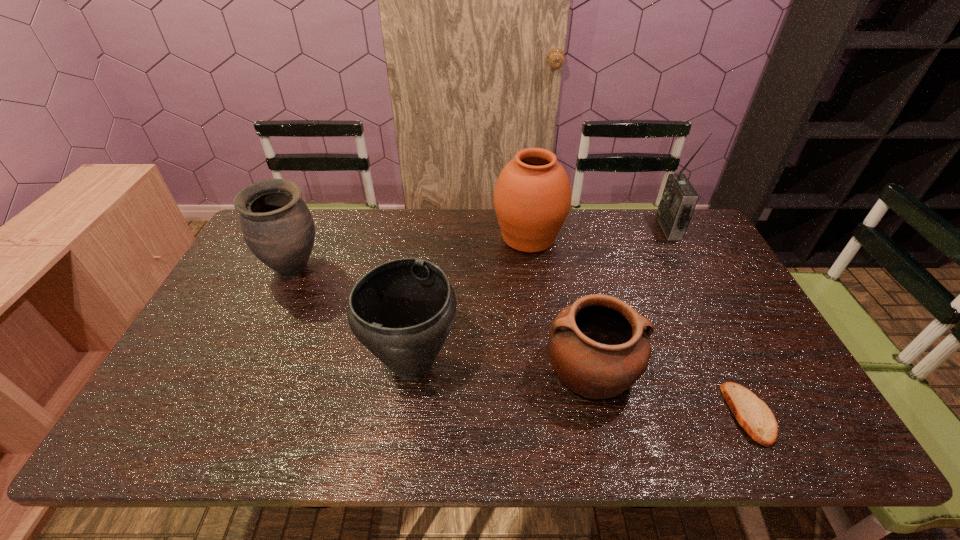
Locate which urn is the closest to the rightmost urn. Please provide its 2D coordinates. Your answer should be formatted as a tuple, i.e. [(x, y)], where the tuple contains the x and y coordinates of a point satisfying the conditions above.

[(402, 311)]

This screenshot has height=540, width=960. Identify the location of free space that satisfies the following two spatial constraints: 1. on the display of the radio receiver; 2. on the front side of the fifth tallest object. (742, 368).